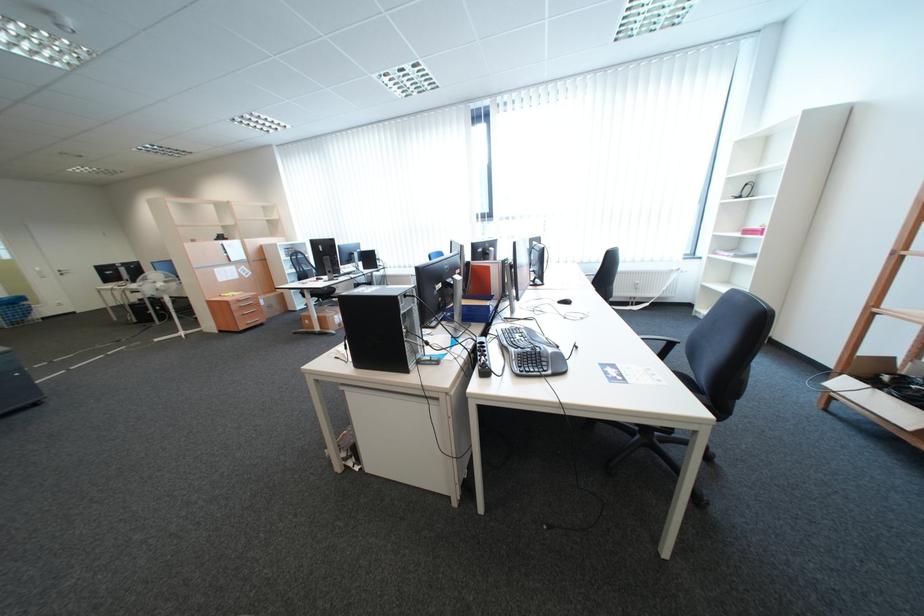
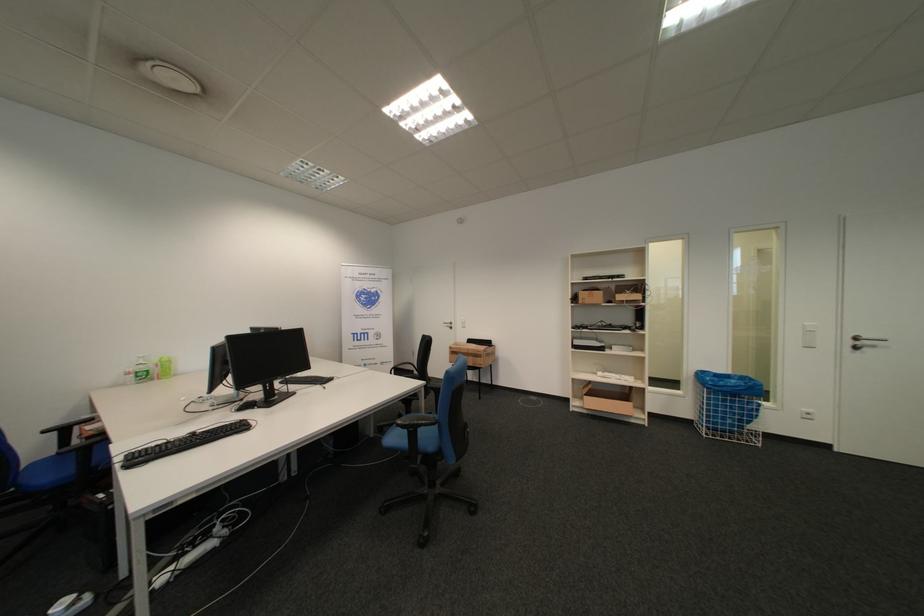
Where in the second image is the point corresponding to pixel 70 274 from the first image?

(862, 344)